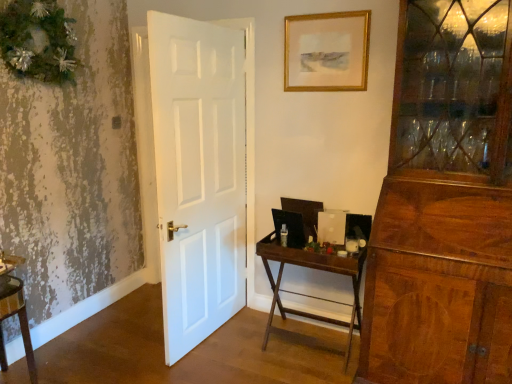
Question: Is gold-framed picture at upper center surrounding wooden folding table at center?

Choices:
 (A) yes
 (B) no

Answer: (B)

Question: Would you say gold-framed picture at upper center is outside wooden folding table at center?

Choices:
 (A) yes
 (B) no

Answer: (A)

Question: Does gold-framed picture at upper center lie in front of wooden folding table at center?

Choices:
 (A) no
 (B) yes

Answer: (A)

Question: From a real-world perspective, is gold-framed picture at upper center on top of wooden folding table at center?

Choices:
 (A) yes
 (B) no

Answer: (A)

Question: Does gold-framed picture at upper center have a greater height compared to wooden folding table at center?

Choices:
 (A) yes
 (B) no

Answer: (B)

Question: In terms of size, does wooden vanity at lower left appear bigger or smaller than wooden folding table at center?

Choices:
 (A) small
 (B) big

Answer: (A)

Question: Visually, is wooden vanity at lower left positioned to the left or to the right of wooden folding table at center?

Choices:
 (A) left
 (B) right

Answer: (A)

Question: Is wooden vanity at lower left spatially inside wooden folding table at center, or outside of it?

Choices:
 (A) inside
 (B) outside

Answer: (B)

Question: Considering the positions of wooden vanity at lower left and wooden folding table at center in the image, is wooden vanity at lower left wider or thinner than wooden folding table at center?

Choices:
 (A) wide
 (B) thin

Answer: (B)

Question: Considering the positions of green textured wreath at upper left and wooden folding table at center in the image, is green textured wreath at upper left taller or shorter than wooden folding table at center?

Choices:
 (A) short
 (B) tall

Answer: (A)

Question: Is green textured wreath at upper left wider or thinner than wooden folding table at center?

Choices:
 (A) thin
 (B) wide

Answer: (A)

Question: Is green textured wreath at upper left bigger or smaller than wooden folding table at center?

Choices:
 (A) big
 (B) small

Answer: (B)

Question: Considering the positions of point (33, 18) and point (280, 269), is point (33, 18) closer or farther from the camera than point (280, 269)?

Choices:
 (A) farther
 (B) closer

Answer: (B)

Question: Considering their positions, is wooden folding table at center located in front of or behind gold-framed picture at upper center?

Choices:
 (A) front
 (B) behind

Answer: (A)

Question: Is wooden folding table at center inside or outside of gold-framed picture at upper center?

Choices:
 (A) outside
 (B) inside

Answer: (A)